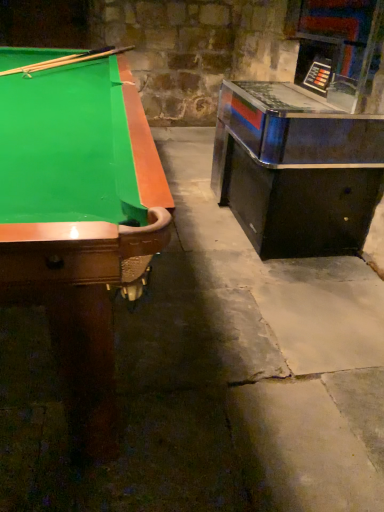
Question: Do you think green felt pool table at left is within metallic/reflective game machine at right, or outside of it?

Choices:
 (A) inside
 (B) outside

Answer: (B)

Question: Is point (81, 219) positioned closer to the camera than point (344, 199)?

Choices:
 (A) closer
 (B) farther

Answer: (A)

Question: Estimate the real-world distances between objects in this image. Which object is farther from the wooden cue at upper left?

Choices:
 (A) metallic/reflective game machine at right
 (B) green felt pool table at left

Answer: (A)

Question: Estimate the real-world distances between objects in this image. Which object is farther from the green felt pool table at left?

Choices:
 (A) wooden cue at upper left
 (B) metallic/reflective game machine at right

Answer: (B)